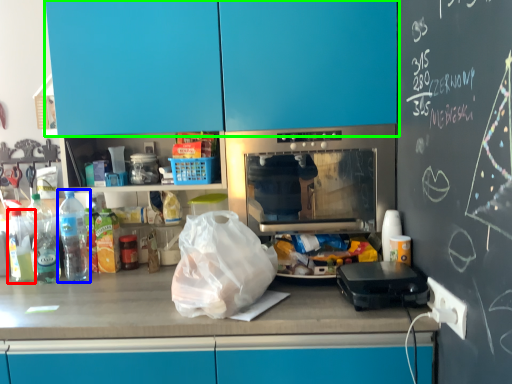
Question: Based on their relative distances, which object is farther from bottle (highlighted by a red box)? Choose from bottle (highlighted by a blue box) and cabinetry (highlighted by a green box).

Choices:
 (A) bottle
 (B) cabinetry

Answer: (B)